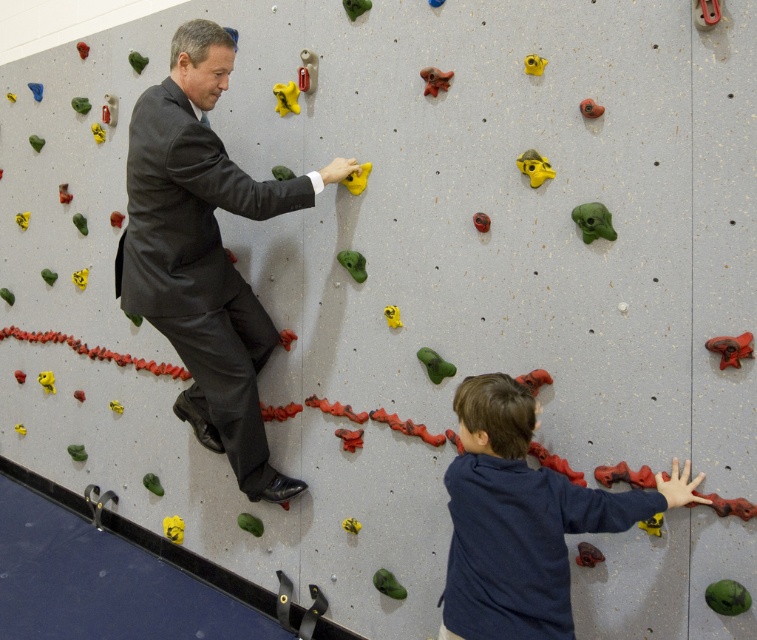
You are a photographer positioned in front of the climbing wall. You want to take a photo that includes both the dark gray suit at center and the dark blue sweater at lower right. Which clothing item will appear larger in your photo?

The dark gray suit at center will appear larger in the photo because it is closer to the photographer than the dark blue sweater at lower right, making it appear bigger due to its proximity.

You are a climber trying to reach the top of the climbing wall. You notice two points on the wall marked as point (132, 282) and point (503, 609). Which point is closer to you as you climb?

Point (132, 282) is closer to you because it is further to the viewer than point (503, 609).

You are a gym instructor observing the climbing wall. You notice two climbers wearing the dark gray suit at center and the dark blue sweater at lower right. Which climber is higher up on the wall?

The dark gray suit at center is higher up on the wall than the dark blue sweater at lower right because the dark gray suit at center is above dark blue sweater at lower right.